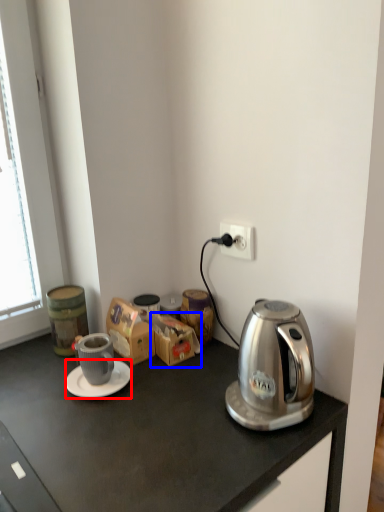
Question: Among these objects, which one is farthest to the camera, saucer (highlighted by a red box) or cardboard box (highlighted by a blue box)?

Choices:
 (A) saucer
 (B) cardboard box

Answer: (B)